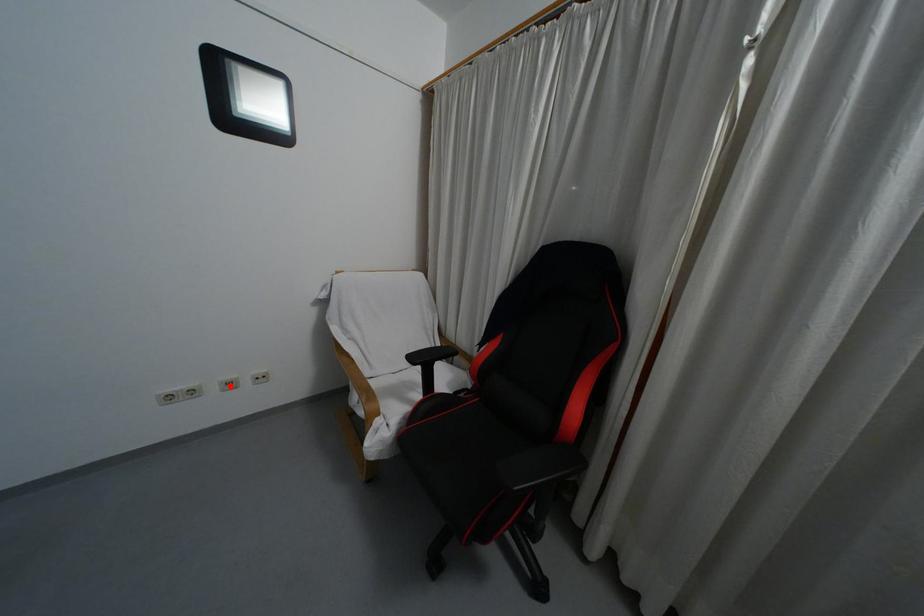
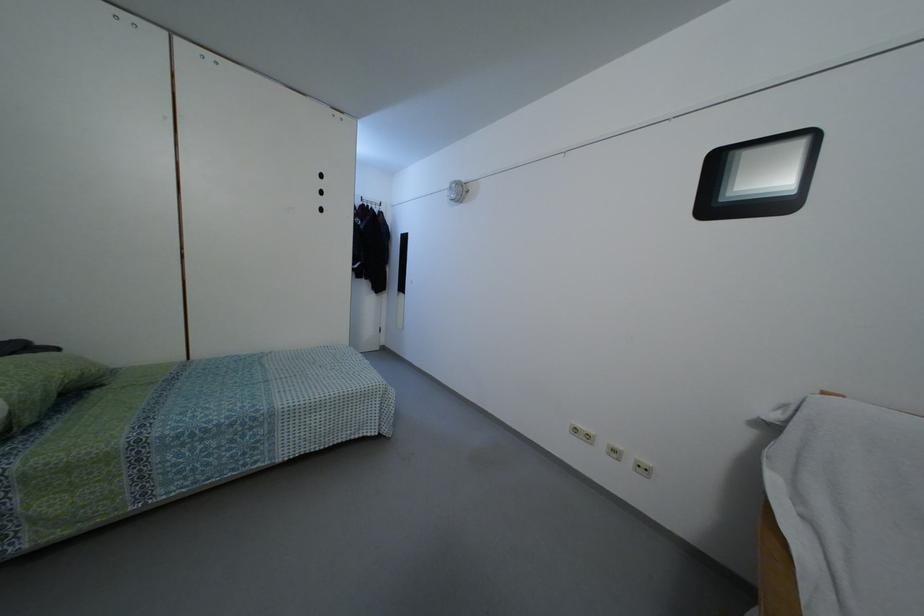
Where in the second image is the point corresponding to the highlighted location from the first image?

(614, 456)